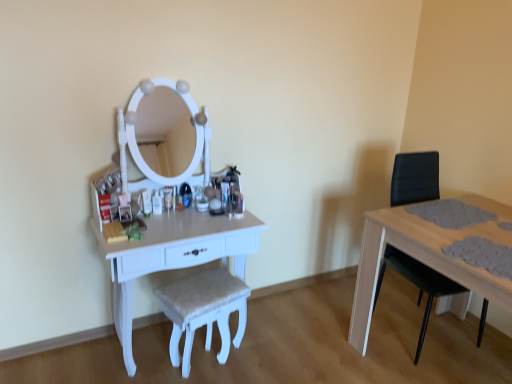
Question: Looking at their shapes, would you say white textured stool at center is wider or thinner than black leather swivel chair at right?

Choices:
 (A) wide
 (B) thin

Answer: (B)

Question: Is white textured stool at center taller or shorter than black leather swivel chair at right?

Choices:
 (A) short
 (B) tall

Answer: (A)

Question: Based on their relative distances, which object is nearer to the black leather swivel chair at right?

Choices:
 (A) white textured stool at center
 (B) white glossy table at left

Answer: (A)

Question: Considering the real-world distances, which object is farthest from the white textured stool at center?

Choices:
 (A) black leather swivel chair at right
 (B) white glossy table at left

Answer: (A)